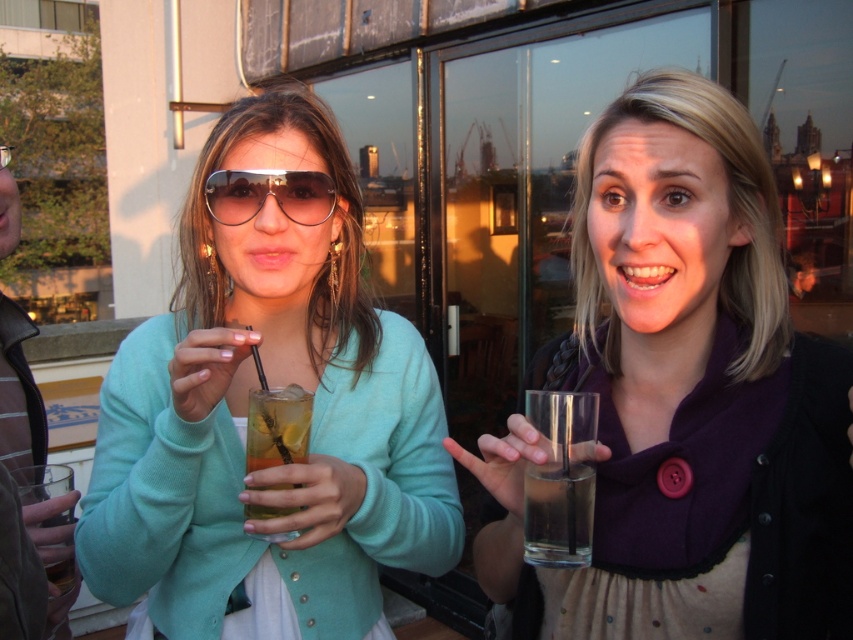
You are a photographer trying to capture a closeup shot of the clear glass water at center and the matte black sweater at upper right. Your camera has a maximum focus range of 10 centimeters. Can you fit both objects in the frame without moving the camera?

The distance between the clear glass water at center and the matte black sweater at upper right is 9.43 centimeters, which is within the camera maximum focus range of 10 centimeters. Therefore, you can fit both objects in the frame without moving the camera.

You are a photographer trying to capture the matte teal sweater at center and the metallic aviator sunglasses at center in a single shot. Based on their positions, which object should you focus on first if you want to ensure both are in sharp focus?

The matte teal sweater at center is located below metallic aviator sunglasses at center. Since the sweater is lower, focusing on the metallic aviator sunglasses at center first would allow the sweater to fall within the depth of field, ensuring both are in focus.

You are a photographer trying to capture a closeup of the clear glass water at center without the matte black sweater at upper right appearing in the background. Is this possible given their positions?

Yes, the clear glass water at center is in front of the matte black sweater at upper right, so you can focus on the clear glass water at center and exclude the matte black sweater at upper right from the frame.